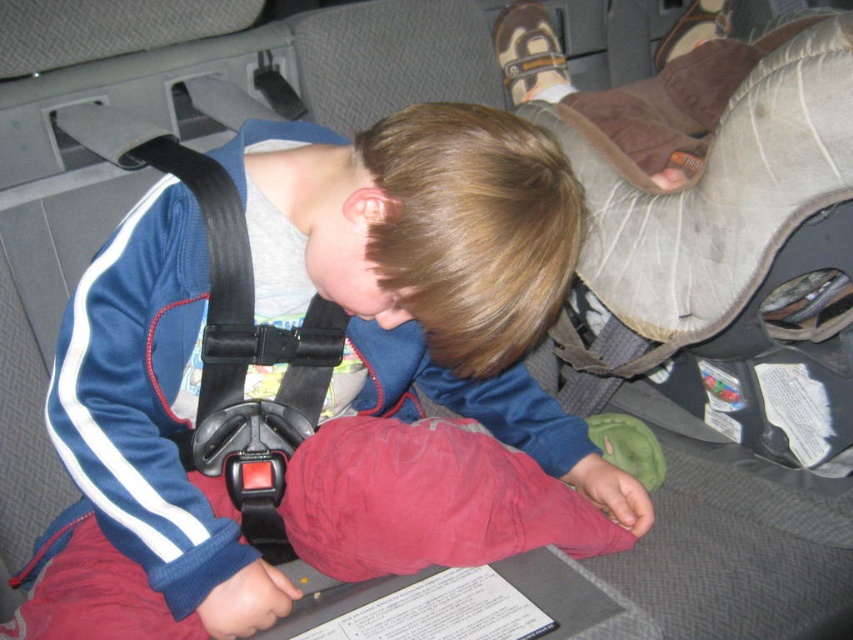
Question: Does matte blue jacket at center appear on the left side of black plastic seatbelt at center?

Choices:
 (A) no
 (B) yes

Answer: (A)

Question: Which of the following is the closest to the observer?

Choices:
 (A) (123, 364)
 (B) (224, 234)

Answer: (A)

Question: Can you confirm if matte blue jacket at center is positioned below black plastic seatbelt at center?

Choices:
 (A) yes
 (B) no

Answer: (A)

Question: Is matte blue jacket at center bigger than black plastic seatbelt at center?

Choices:
 (A) no
 (B) yes

Answer: (B)